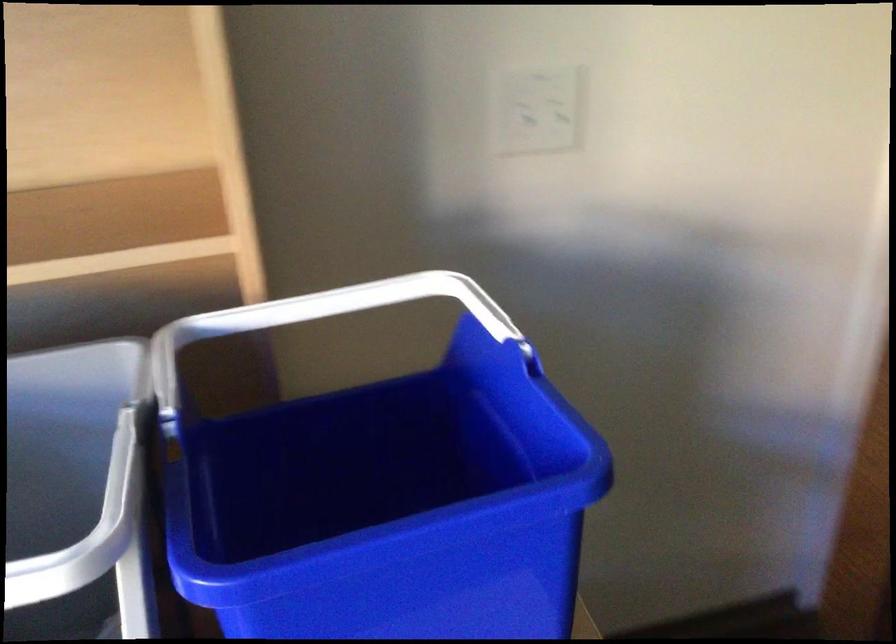
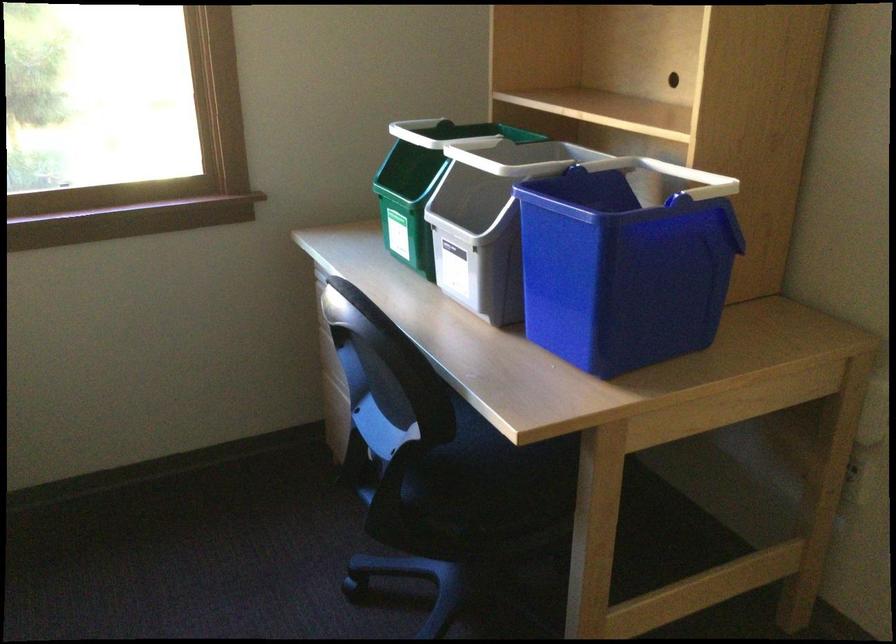
Question: I am providing you with two images of the same scene from different viewpoints. Please identify which objects are invisible in image2.

Choices:
 (A) green recycling bin
 (B) white bin handle
 (C) grey recycling bin
 (D) orange toy vehicle

Answer: (B)